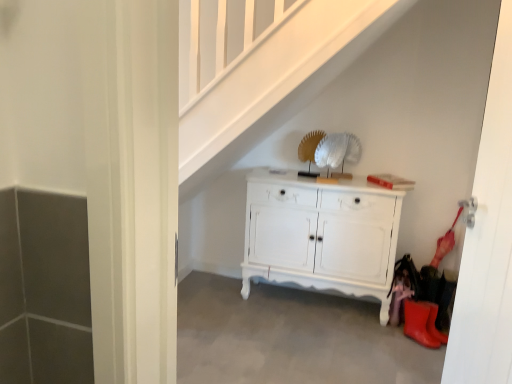
The height and width of the screenshot is (384, 512). Describe the element at coordinates (488, 239) in the screenshot. I see `white glossy door at right` at that location.

This screenshot has height=384, width=512. I want to click on white glossy door at right, so click(488, 239).

Describe the element at coordinates (321, 234) in the screenshot. I see `white painted wood cabinet at center` at that location.

In order to face rubber/matte boot at lower right, should I rotate leftwards or rightwards?

To face it directly, rotate right by 21.008 degrees.

What are the coordinates of `white glossy door at right` in the screenshot? It's located at (488, 239).

In the scene shown: Looking at their sizes, would you say white glossy door at right is wider or thinner than rubber/matte boot at lower right?

Considering their sizes, white glossy door at right looks slimmer than rubber/matte boot at lower right.

From the image's perspective, between white glossy door at right and rubber/matte boot at lower right, which one is located above?

white glossy door at right, from the image's perspective.

Considering the positions of objects white glossy door at right and rubber/matte boot at lower right in the image provided, who is in front, white glossy door at right or rubber/matte boot at lower right?

white glossy door at right is more forward.

Where is `door that appears above the rubber/matte boot at lower right (from a real-world perspective)`? This screenshot has height=384, width=512. door that appears above the rubber/matte boot at lower right (from a real-world perspective) is located at coordinates (488, 239).

Is point (331, 359) closer to viewer compared to point (437, 343)?

Yes, it is.

Between gray concrete at lower center and rubber/matte boot at lower right, which one has less height?

Standing shorter between the two is gray concrete at lower center.

From the image's perspective, which object appears higher, gray concrete at lower center or rubber/matte boot at lower right?

rubber/matte boot at lower right, from the image's perspective.

From a real-world perspective, which object stands above the other?

From a 3D spatial view, rubber/matte boot at lower right is above.

Which is in front, rubber/matte boot at lower right or white glossy door at right?

white glossy door at right is more forward.

Based on their positions, is rubber/matte boot at lower right located to the left or right of white glossy door at right?

Clearly, rubber/matte boot at lower right is on the right of white glossy door at right in the image.

The height and width of the screenshot is (384, 512). I want to click on door above the rubber/matte boot at lower right (from a real-world perspective), so pos(488,239).

Are rubber/matte boot at lower right and white glossy door at right making contact?

There is a gap between rubber/matte boot at lower right and white glossy door at right.

In the scene shown: Is rubber/matte boot at lower right a part of white painted wood cabinet at center?

No, rubber/matte boot at lower right is located outside of white painted wood cabinet at center.

Which point is more forward, (317, 195) or (415, 306)?

The point (415, 306) is in front.

Is the position of white painted wood cabinet at center more distant than that of rubber/matte boot at lower right?

Yes, it is behind rubber/matte boot at lower right.

Considering the relative sizes of white painted wood cabinet at center and rubber/matte boot at lower right in the image provided, is white painted wood cabinet at center thinner than rubber/matte boot at lower right?

No.

You are a GUI agent. You are given a task and a screenshot of the screen. Output one action in this format:
    pyautogui.click(x=<x>, y=<y>)
    Task: Click on the chest of drawers that appears above the gray concrete at lower center (from the image's perspective)
    The image size is (512, 384).
    Given the screenshot: What is the action you would take?
    click(x=321, y=234)

Which point is more distant from viewer, (279, 360) or (361, 201)?

Positioned behind is point (361, 201).

Can you confirm if gray concrete at lower center is thinner than white painted wood cabinet at center?

No, gray concrete at lower center is not thinner than white painted wood cabinet at center.

Can you tell me how much white painted wood cabinet at center and white glossy door at right differ in facing direction?

There is a 82.7-degree angle between the facing directions of white painted wood cabinet at center and white glossy door at right.

Where is `the chest of drawers directly beneath the white glossy door at right (from a real-world perspective)`? The image size is (512, 384). the chest of drawers directly beneath the white glossy door at right (from a real-world perspective) is located at coordinates (321, 234).

From the image's perspective, is white painted wood cabinet at center located above or below white glossy door at right?

white painted wood cabinet at center is below white glossy door at right.

How much distance is there between white painted wood cabinet at center and white glossy door at right?

white painted wood cabinet at center is 1.05 meters away from white glossy door at right.

From the image's perspective, relative to gray concrete at lower center, is rubber/matte boot at lower right above or below?

rubber/matte boot at lower right is above gray concrete at lower center.

Is rubber/matte boot at lower right wider or thinner than gray concrete at lower center?

Considering their sizes, rubber/matte boot at lower right looks slimmer than gray concrete at lower center.

From a real-world perspective, is rubber/matte boot at lower right located beneath gray concrete at lower center?

No, from a real-world perspective, rubber/matte boot at lower right is not below gray concrete at lower center.

Based on their positions, is rubber/matte boot at lower right located to the left or right of gray concrete at lower center?

From the image, it's evident that rubber/matte boot at lower right is to the right of gray concrete at lower center.

This screenshot has height=384, width=512. What are the coordinates of `door that appears on the left of rubber/matte boot at lower right` in the screenshot? It's located at (488, 239).

Locate an element on the screen. The width and height of the screenshot is (512, 384). concrete in front of the rubber/matte boot at lower right is located at coordinates (290, 337).

From the image, which object appears to be nearer to rubber/matte boot at lower right, gray concrete at lower center or white painted wood cabinet at center?

The object closer to rubber/matte boot at lower right is white painted wood cabinet at center.

Which object lies further to the anchor point white painted wood cabinet at center, rubber/matte boot at lower right or gray concrete at lower center?

The object further to white painted wood cabinet at center is rubber/matte boot at lower right.

Which object lies nearer to the anchor point white glossy door at right, gray concrete at lower center or rubber/matte boot at lower right?

rubber/matte boot at lower right is closer to white glossy door at right.

Which object lies nearer to the anchor point white painted wood cabinet at center, gray concrete at lower center or rubber/matte boot at lower right?

gray concrete at lower center is closer to white painted wood cabinet at center.

Looking at the image, which one is located further to rubber/matte boot at lower right, white glossy door at right or gray concrete at lower center?

Among the two, white glossy door at right is located further to rubber/matte boot at lower right.

Looking at the image, which one is located closer to white painted wood cabinet at center, white glossy door at right or gray concrete at lower center?

gray concrete at lower center.

Looking at the image, which one is located closer to gray concrete at lower center, rubber/matte boot at lower right or white painted wood cabinet at center?

white painted wood cabinet at center lies closer to gray concrete at lower center than the other object.

From the image, which object appears to be farther from gray concrete at lower center, white glossy door at right or white painted wood cabinet at center?

white glossy door at right lies further to gray concrete at lower center than the other object.

Where is `shoe positioned between gray concrete at lower center and white painted wood cabinet at center from near to far`? This screenshot has height=384, width=512. shoe positioned between gray concrete at lower center and white painted wood cabinet at center from near to far is located at coordinates (418, 323).

At what (x,y) coordinates should I click in order to perform the action: click on shoe between white glossy door at right and white painted wood cabinet at center from front to back. Please return your answer as a coordinate pair (x, y). This screenshot has width=512, height=384. Looking at the image, I should click on (418, 323).

At what (x,y) coordinates should I click in order to perform the action: click on concrete between white glossy door at right and white painted wood cabinet at center along the z-axis. Please return your answer as a coordinate pair (x, y). Looking at the image, I should click on (290, 337).

This screenshot has width=512, height=384. In order to click on concrete between white glossy door at right and rubber/matte boot at lower right along the z-axis in this screenshot , I will do `click(290, 337)`.